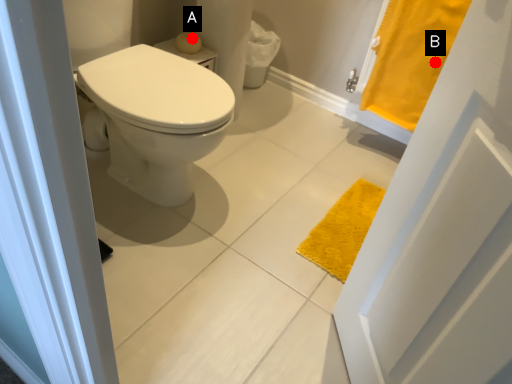
Question: Two points are circled on the image, labeled by A and B beside each circle. Which point is farther from the camera taking this photo?

Choices:
 (A) A is further
 (B) B is further

Answer: (A)